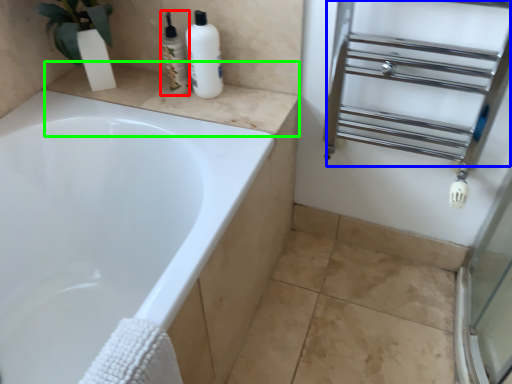
Question: Which object is positioned farthest from toiletry (highlighted by a red box)? Select from shelf (highlighted by a blue box) and counter top (highlighted by a green box).

Choices:
 (A) shelf
 (B) counter top

Answer: (A)